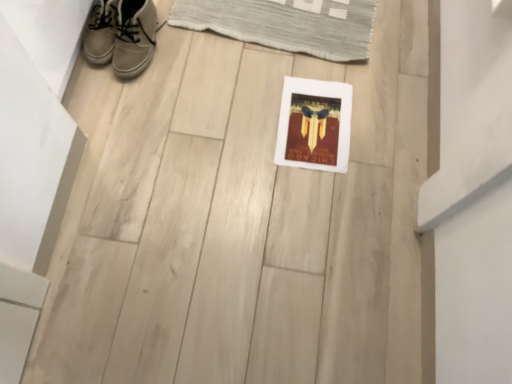
Image resolution: width=512 pixels, height=384 pixels. Find the location of `vacant space situated on the left part of white matte picture frame at center`. vacant space situated on the left part of white matte picture frame at center is located at coordinates (238, 116).